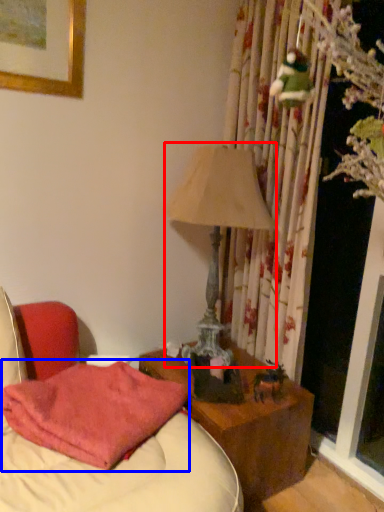
Question: Which point is further to the camera, table lamp (highlighted by a red box) or pillow (highlighted by a blue box)?

Choices:
 (A) table lamp
 (B) pillow

Answer: (A)